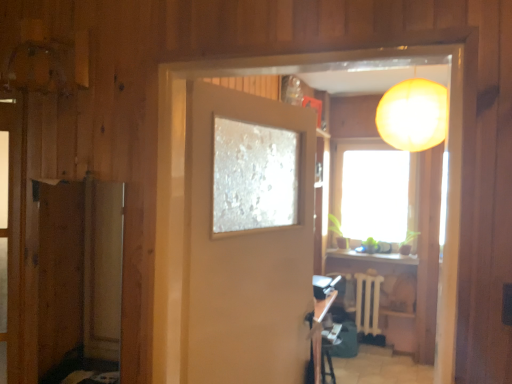
Question: Is matte orange lampshade at upper right wider or thinner than white plastic radiator at center?

Choices:
 (A) thin
 (B) wide

Answer: (B)

Question: Is matte orange lampshade at upper right in front of or behind white plastic radiator at center in the image?

Choices:
 (A) front
 (B) behind

Answer: (A)

Question: Based on their relative distances, which object is farther from the wooden table at lower center?

Choices:
 (A) matte orange lampshade at upper right
 (B) wooden screen door at left
 (C) transparent glass window at center
 (D) white plastic radiator at center
 (E) matte beige door at center

Answer: (C)

Question: Estimate the real-world distances between objects in this image. Which object is farther from the wooden screen door at left?

Choices:
 (A) wooden table at lower center
 (B) white plastic radiator at center
 (C) matte beige door at center
 (D) matte orange lampshade at upper right
 (E) transparent glass window at center

Answer: (E)